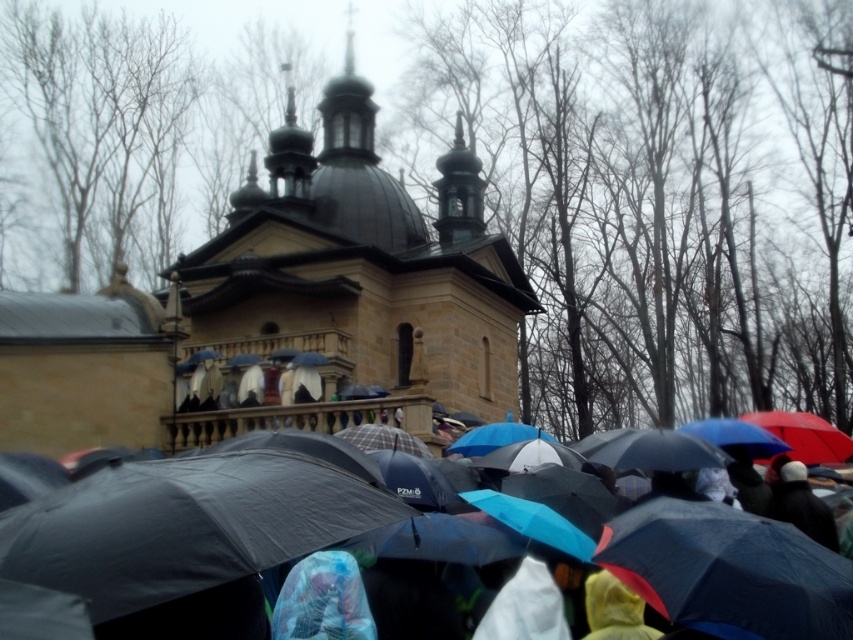
You are an architect analyzing the spatial relationship between the brown stone church at center and the matte black umbrellas at center. According to the scene, which object is positioned higher in elevation?

The brown stone church at center is located above matte black umbrellas at center, so it is positioned higher in elevation.

Based on the photo, you are a photographer trying to capture a clear shot of the brown stone church at center. However, there are matte black umbrellas at center in the scene. Based on their positions, can you determine if the umbrellas will block your view of the church?

The matte black umbrellas at center are positioned behind the brown stone church at center, so they will not block your view of the church.

You are an architect observing the scene. You need to determine the spatial relationship between the brown stone church at center and the matte black umbrellas at center. Which object is located to the left of the other?

The brown stone church at center is positioned on the left side of matte black umbrellas at center.